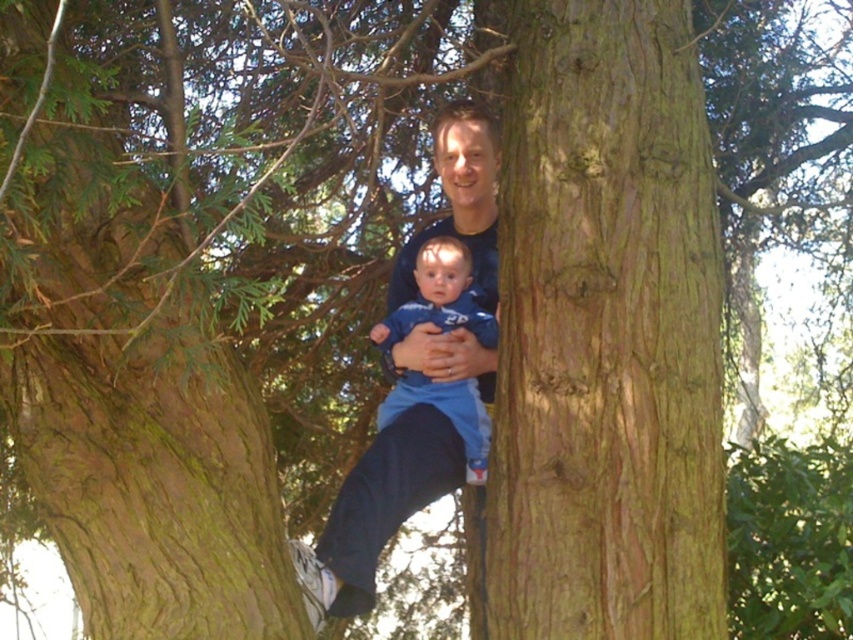
Question: Which point is farther to the camera?

Choices:
 (A) (421, 301)
 (B) (326, 582)

Answer: (A)

Question: Does dark blue shirt at center appear over blue soft fabric baby at center?

Choices:
 (A) no
 (B) yes

Answer: (A)

Question: Where is dark blue shirt at center located in relation to blue soft fabric baby at center in the image?

Choices:
 (A) left
 (B) right

Answer: (A)

Question: Which object appears farthest from the camera in this image?

Choices:
 (A) blue soft fabric baby at center
 (B) dark blue shirt at center

Answer: (A)

Question: Is dark blue shirt at center positioned before blue soft fabric baby at center?

Choices:
 (A) yes
 (B) no

Answer: (A)

Question: Which of the following is the closest to the observer?

Choices:
 (A) (476, 371)
 (B) (427, 291)

Answer: (A)